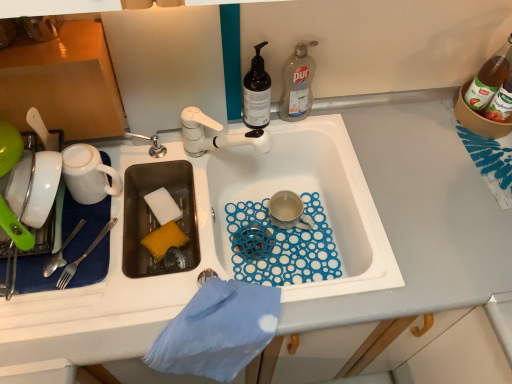
Where is `empty space that is ontop of white plastic sink at center (from a real-world perspective)`? The image size is (512, 384). empty space that is ontop of white plastic sink at center (from a real-world perspective) is located at coordinates (312, 289).